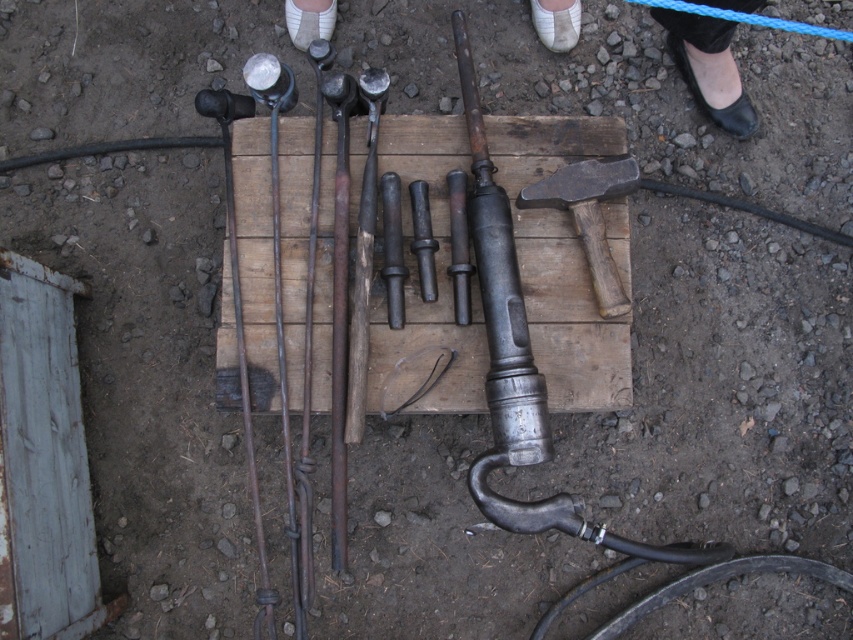
Question: Is white leather shoe at upper center to the left of dark gray wooden hammer at center from the viewer's perspective?

Choices:
 (A) no
 (B) yes

Answer: (A)

Question: Which point is closer to the camera?

Choices:
 (A) dark gray wooden hammer at center
 (B) white leather shoe at upper center

Answer: (A)

Question: Is white leather shoe at upper center behind dark gray wooden hammer at center?

Choices:
 (A) no
 (B) yes

Answer: (B)

Question: Does white leather shoe at upper center appear on the right side of dark gray wooden hammer at center?

Choices:
 (A) no
 (B) yes

Answer: (B)